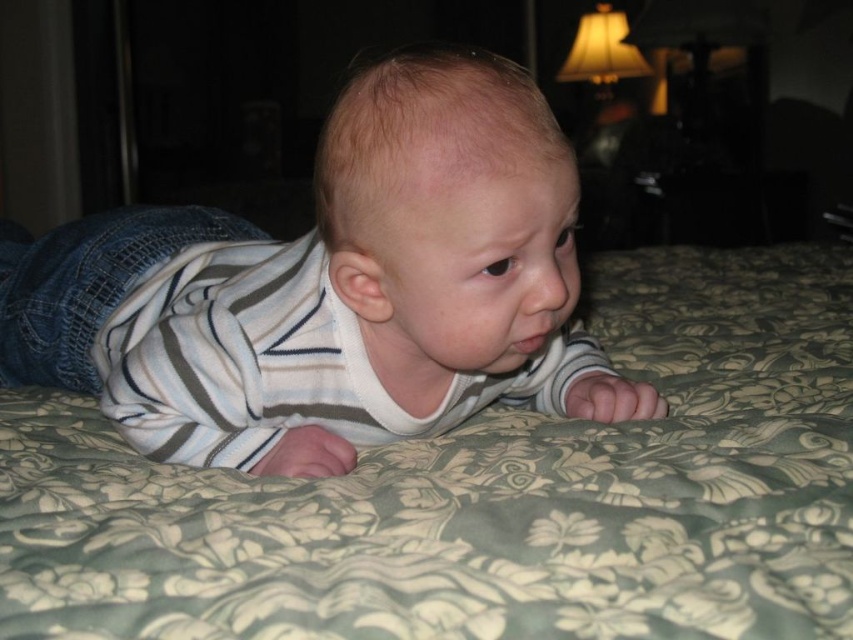
Question: Which object is farther from the camera taking this photo?

Choices:
 (A) white striped shirt at center
 (B) floral fabric bedcover at center

Answer: (A)

Question: Can you confirm if floral fabric bedcover at center is positioned above white striped shirt at center?

Choices:
 (A) no
 (B) yes

Answer: (B)

Question: Which of the following is the closest to the observer?

Choices:
 (A) (450, 419)
 (B) (143, 547)

Answer: (B)

Question: Which point is farther to the camera?

Choices:
 (A) floral fabric bedcover at center
 (B) white striped shirt at center

Answer: (B)

Question: Can you confirm if floral fabric bedcover at center is positioned to the left of white striped shirt at center?

Choices:
 (A) no
 (B) yes

Answer: (A)

Question: Does floral fabric bedcover at center have a lesser width compared to white striped shirt at center?

Choices:
 (A) yes
 (B) no

Answer: (B)